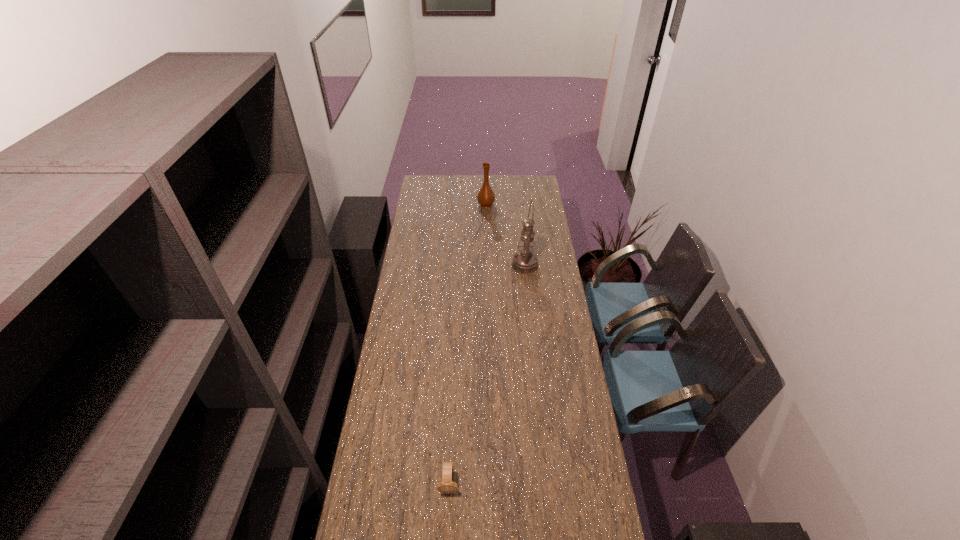
Find the location of a particular element. This screenshot has height=540, width=960. the rightmost object is located at coordinates (525, 262).

At what (x,y) coordinates should I click in order to perform the action: click on the second nearest object. Please return your answer as a coordinate pair (x, y). Looking at the image, I should click on (525, 262).

Locate an element on the screen. This screenshot has width=960, height=540. vase is located at coordinates (485, 197).

This screenshot has height=540, width=960. I want to click on the second object from right to left, so click(x=485, y=197).

This screenshot has width=960, height=540. I want to click on the shortest object, so click(447, 485).

Identify the location of the leftmost object. Image resolution: width=960 pixels, height=540 pixels. (447, 485).

Find the location of a particular element. The height and width of the screenshot is (540, 960). free location located 0.230m on the back of the tallest object is located at coordinates (521, 231).

This screenshot has height=540, width=960. In order to click on free location located on the right of the vase in this screenshot , I will do `click(533, 205)`.

I want to click on vacant space located 0.130m on the face of the shortest object, so click(x=446, y=539).

Where is `object that is at the right edge`? Image resolution: width=960 pixels, height=540 pixels. object that is at the right edge is located at coordinates [x=525, y=262].